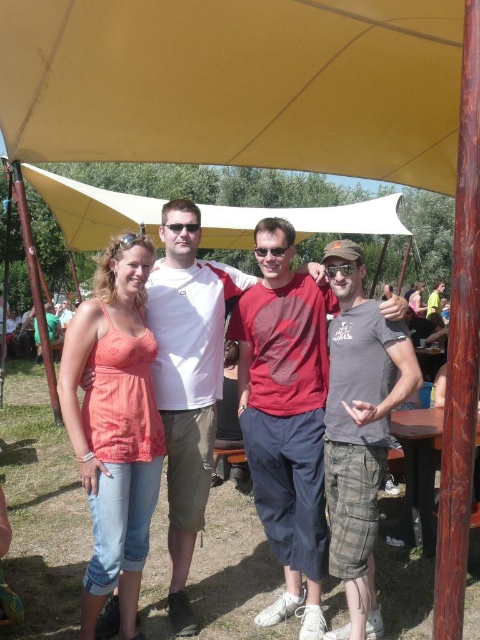
Is yellow fabric canopy at upper center thinner than gray cotton t-shirt at center?

No.

Does yellow fabric canopy at upper center come in front of gray cotton t-shirt at center?

That is False.

Who is more distant from viewer, (111, 6) or (361, 515)?

Positioned behind is point (111, 6).

I want to click on yellow fabric canopy at upper center, so 237,83.

Does matte coral tank top at left come behind pink fabric dress at center?

No, it is in front of pink fabric dress at center.

Is matte coral tank top at left smaller than pink fabric dress at center?

Yes, matte coral tank top at left is smaller than pink fabric dress at center.

Is point (79, 344) behind point (421, 310)?

No, (79, 344) is closer to viewer.

At what (x,y) coordinates should I click in order to perform the action: click on matte coral tank top at left. Please return your answer as a coordinate pair (x, y). The image size is (480, 640). Looking at the image, I should click on (115, 426).

Which is more to the right, gray cotton t-shirt at center or pink fabric dress at center?

pink fabric dress at center

Which is above, gray cotton t-shirt at center or pink fabric dress at center?

Positioned higher is pink fabric dress at center.

What do you see at coordinates (359, 428) in the screenshot?
I see `gray cotton t-shirt at center` at bounding box center [359, 428].

Locate an element on the screen. The height and width of the screenshot is (640, 480). gray cotton t-shirt at center is located at coordinates (359, 428).